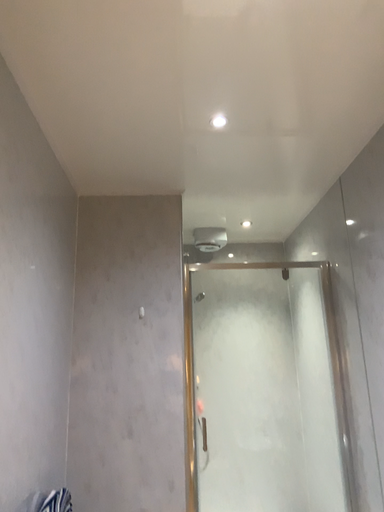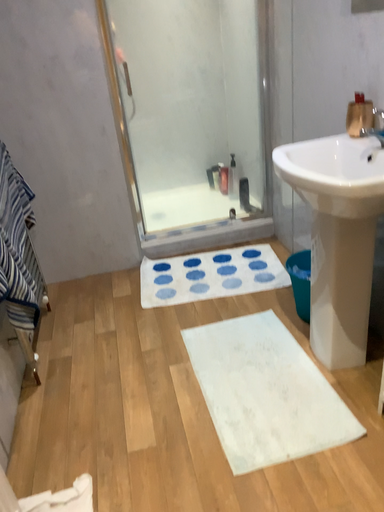
Question: Which way did the camera rotate in the video?

Choices:
 (A) rotated right
 (B) rotated left

Answer: (A)